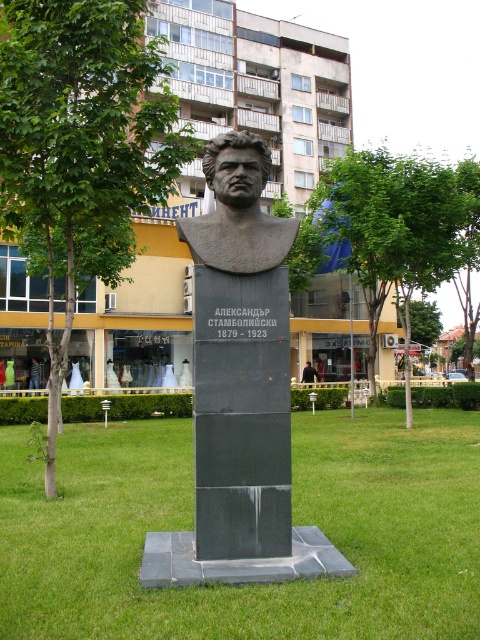
Based on the photo, you are a photographer trying to capture both the black granite bust at center and the green leafy tree at center in a single frame. Based on their sizes, which object will appear smaller in the photo?

The black granite bust at center will appear smaller in the photo because it occupies less space than the green leafy tree at center.

You are a photographer trying to capture the statue and both objects in the scene. Since the green leafy tree at center and the black leather jacket at center are both at the center, which one appears wider in the photo?

The green leafy tree at center appears wider than the black leather jacket at center because its width surpasses that of the black leather jacket at center.

You are a photographer standing in the park and want to take a photo of the statue. You notice a green leafy tree at center and a black leather jacket at center. Which object is positioned to the right when you look at them from your current viewpoint?

The green leafy tree at center is positioned to the right of the black leather jacket at center.